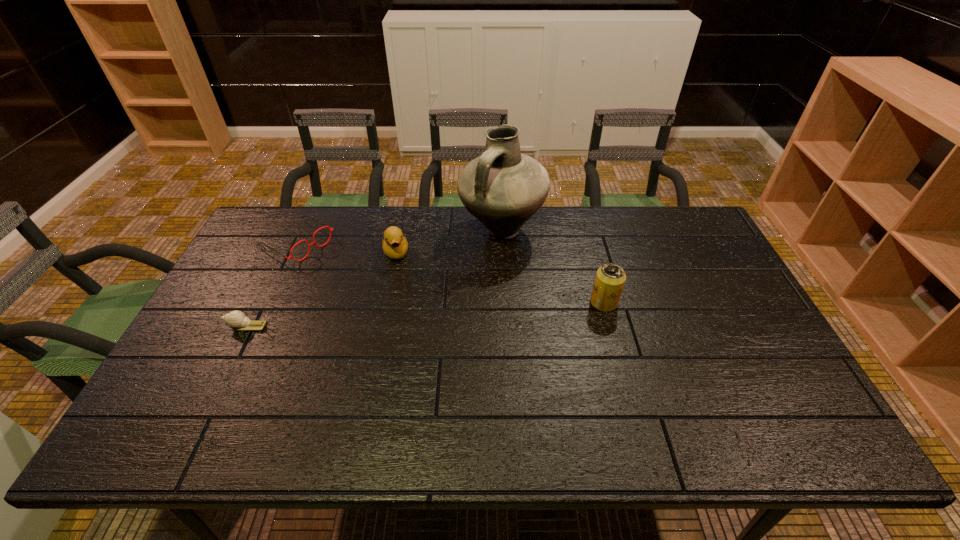
Identify the location of the shortest object. This screenshot has height=540, width=960. (237, 320).

You are a GUI agent. You are given a task and a screenshot of the screen. Output one action in this format:
    pyautogui.click(x=<x>, y=<y>)
    Task: Click on the nearest object
    This screenshot has height=540, width=960.
    Given the screenshot: What is the action you would take?
    (237, 320)

This screenshot has height=540, width=960. Find the location of `the fourth farthest object`. the fourth farthest object is located at coordinates (610, 278).

Image resolution: width=960 pixels, height=540 pixels. I want to click on beer can, so click(x=610, y=278).

Locate an element on the screen. The height and width of the screenshot is (540, 960). duckling is located at coordinates (394, 244).

This screenshot has height=540, width=960. Identify the location of the third tallest object. 394,244.

The width and height of the screenshot is (960, 540). I want to click on spectacles, so click(309, 245).

The image size is (960, 540). What are the coordinates of `pitcher` in the screenshot? It's located at (503, 188).

The height and width of the screenshot is (540, 960). Identify the location of the fourth object from left to right. (503, 188).

Where is `free space located 0.060m on the shell of the nearest object`? The width and height of the screenshot is (960, 540). free space located 0.060m on the shell of the nearest object is located at coordinates (204, 326).